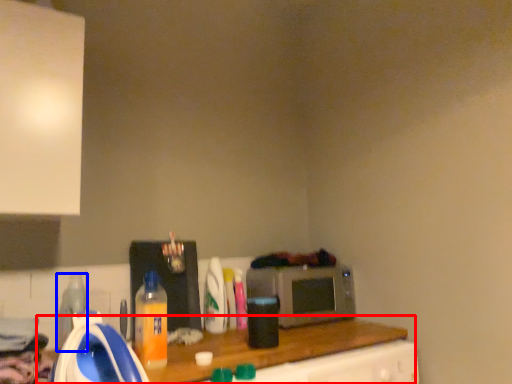
Question: Which point is further to the camera, counter top (highlighted by a red box) or bottle (highlighted by a blue box)?

Choices:
 (A) counter top
 (B) bottle

Answer: (B)